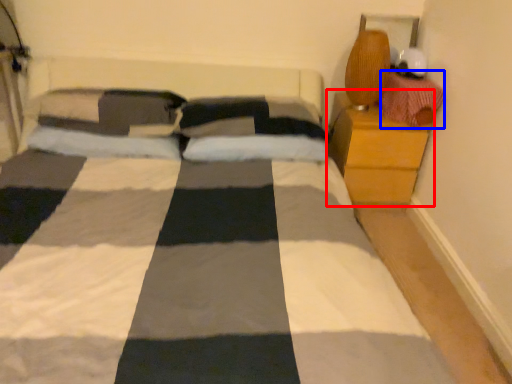
Question: Which of the following is the closest to the observer, nightstand (highlighted by a red box) or material (highlighted by a blue box)?

Choices:
 (A) nightstand
 (B) material

Answer: (B)